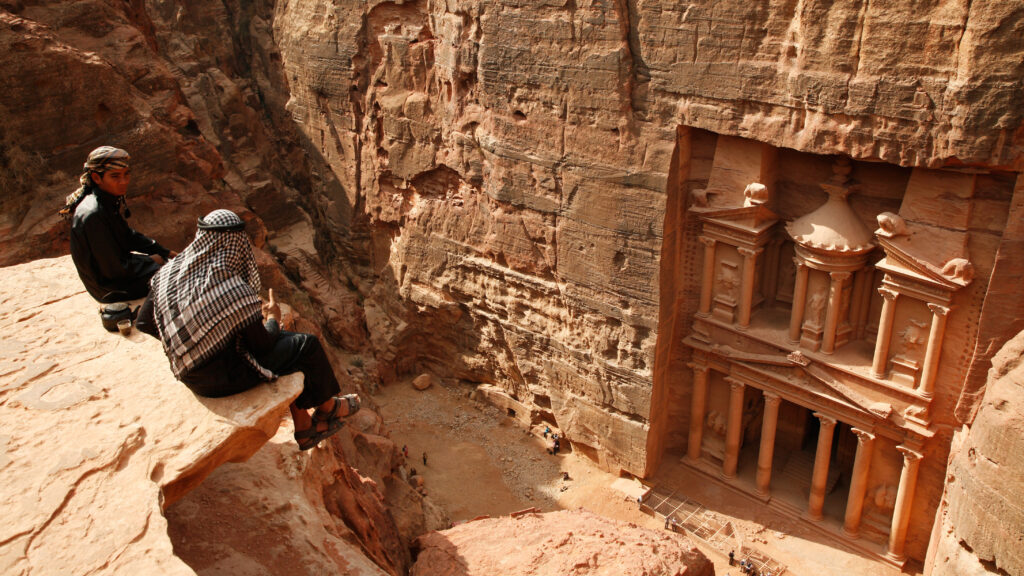
Locate an element on the screen. ledge is located at coordinates (129, 365).